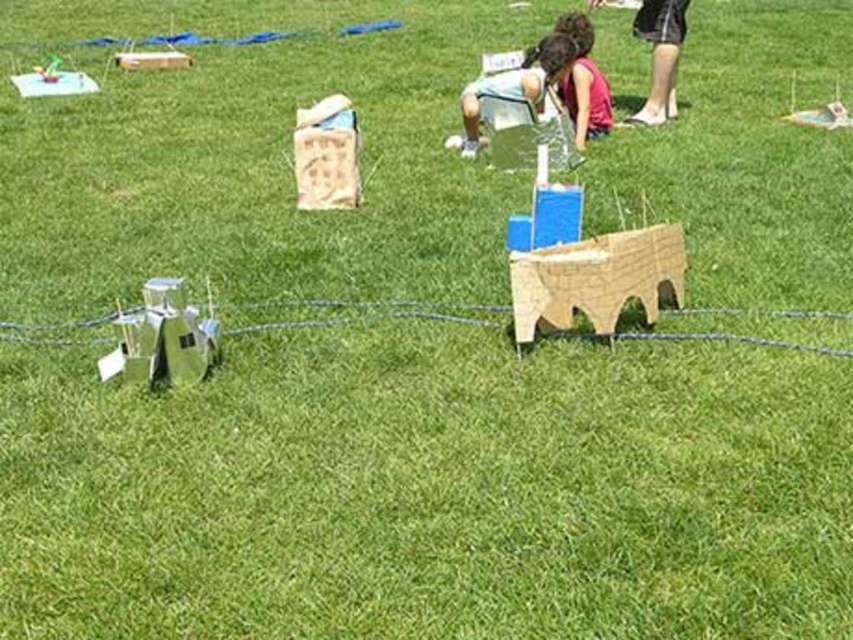
You are standing in the middle of the grassy field and see the green cardboard string at lower left and the black fabric shorts at upper right. Which object is positioned to the left when viewed from your current position?

The green cardboard string at lower left is positioned to the left of the black fabric shorts at upper right.

You are standing at the center of the grassy field and see the light brown cardboard at center and the black fabric shorts at upper right. If you want to place a 4 feet long picnic blanket between them, will it fit without overlapping either object?

The distance between the light brown cardboard at center and the black fabric shorts at upper right is 3.50 feet. Since the picnic blanket is 4 feet long, it will not fit without overlapping because the required space is longer than the available distance.

You are standing in the middle of the grassy field and see the point at coordinates point (838, 310). If you want to walk directly to that point, how far will you have to walk?

The distance of point (838, 310) from viewer is 14.50 feet, so you will have to walk 14.50 feet to reach that point.